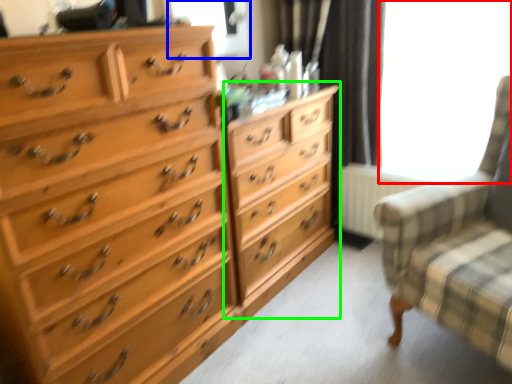
Question: Estimate the real-world distances between objects in this image. Which object is closer to window screen (highlighted by a red box), window screen (highlighted by a blue box) or dresser (highlighted by a green box)?

Choices:
 (A) window screen
 (B) dresser

Answer: (B)